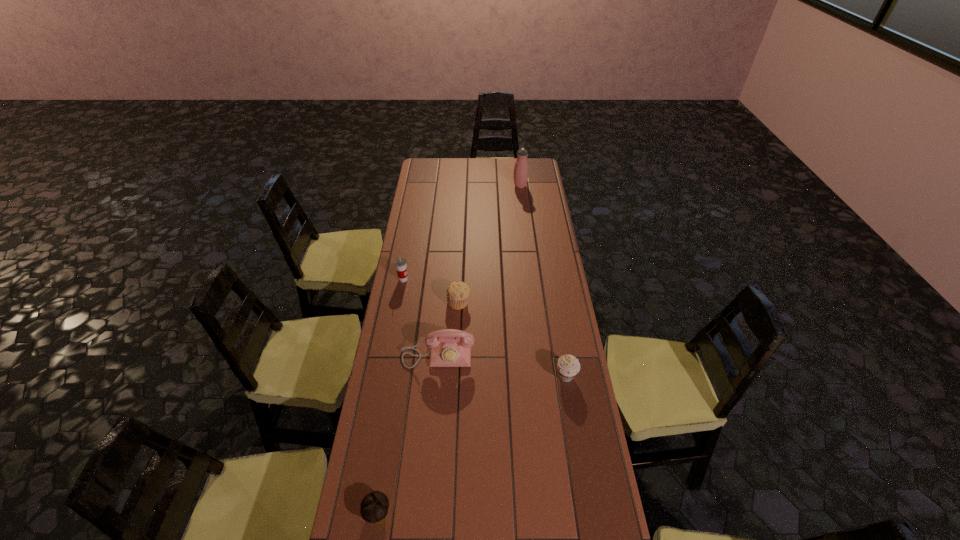
Locate an element on the screen. muffin that is at the right edge is located at coordinates (568, 366).

The height and width of the screenshot is (540, 960). Find the location of `free space at the far edge of the desktop`. free space at the far edge of the desktop is located at coordinates (470, 178).

Locate an element on the screen. Image resolution: width=960 pixels, height=540 pixels. free region at the left edge of the desktop is located at coordinates (389, 335).

Locate an element on the screen. vacant space at the right edge of the desktop is located at coordinates (538, 322).

At what (x,y) coordinates should I click in order to perform the action: click on free space at the far left corner of the desktop. Please return your answer as a coordinate pair (x, y). The height and width of the screenshot is (540, 960). Looking at the image, I should click on tap(420, 163).

In order to click on vacant region between the fourth nearest object and the telephone in this screenshot , I will do `click(448, 329)`.

This screenshot has height=540, width=960. In order to click on vacant area that lies between the rightmost muffin and the second muffin from right to left in this screenshot , I will do `click(513, 339)`.

Locate an element on the screen. vacant area between the telephone and the cup is located at coordinates (420, 318).

This screenshot has height=540, width=960. I want to click on vacant area that lies between the second farthest object and the second shortest object, so click(431, 291).

Where is `free space that is in between the farthest object and the fifth nearest object`? This screenshot has width=960, height=540. free space that is in between the farthest object and the fifth nearest object is located at coordinates (462, 233).